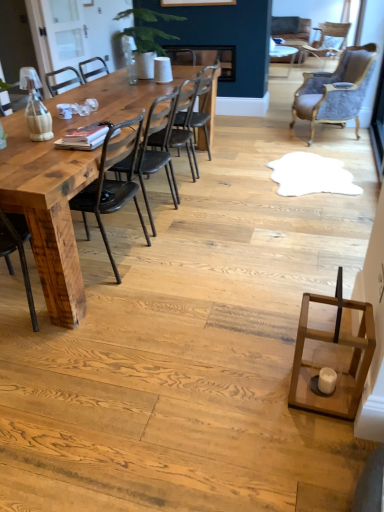
Question: Is the surface of black leather chair at center, arranged as the 3th chair when ordered from the bottom, in direct contact with velvet grey armchair at upper right, acting as the 4th chair starting from the bottom?

Choices:
 (A) yes
 (B) no

Answer: (B)

Question: From a real-world perspective, is black leather chair at center, the third chair when ordered from top to bottom, positioned under velvet grey armchair at upper right, placed as the 2th chair when sorted from back to front, based on gravity?

Choices:
 (A) no
 (B) yes

Answer: (B)

Question: Is black leather chair at center, which is the third chair in right-to-left order, shorter than velvet grey armchair at upper right, placed as the 2th chair when sorted from right to left?

Choices:
 (A) no
 (B) yes

Answer: (B)

Question: Is black leather chair at center, the third chair in the left-to-right sequence, closer to the viewer compared to velvet grey armchair at upper right, placed as the 2th chair when sorted from right to left?

Choices:
 (A) yes
 (B) no

Answer: (A)

Question: Is black leather chair at center, which is the third chair in right-to-left order, facing away from velvet grey armchair at upper right, acting as the 4th chair starting from the bottom?

Choices:
 (A) yes
 (B) no

Answer: (B)

Question: Considering the relative positions of natural wood table at left and velvet grey armchair at upper right, placed as the 2th chair when sorted from right to left, in the image provided, is natural wood table at left to the left or to the right of velvet grey armchair at upper right, placed as the 2th chair when sorted from right to left,?

Choices:
 (A) left
 (B) right

Answer: (A)

Question: From a real-world perspective, is natural wood table at left physically located above or below velvet grey armchair at upper right, the 4th chair from the left?

Choices:
 (A) above
 (B) below

Answer: (B)

Question: Is natural wood table at left situated inside velvet grey armchair at upper right, the second chair when ordered from top to bottom, or outside?

Choices:
 (A) inside
 (B) outside

Answer: (B)

Question: Relative to velvet grey armchair at upper right, arranged as the fourth chair when viewed from the front, is natural wood table at left in front or behind?

Choices:
 (A) behind
 (B) front

Answer: (B)

Question: Considering the positions of black leather chair at center, the third chair in the left-to-right sequence, and rustic wood chair at left, which ranks as the fifth chair in right-to-left order, in the image, is black leather chair at center, the third chair in the left-to-right sequence, wider or thinner than rustic wood chair at left, which ranks as the fifth chair in right-to-left order,?

Choices:
 (A) wide
 (B) thin

Answer: (B)

Question: Considering their positions, is black leather chair at center, placed as the third chair when sorted from back to front, located in front of or behind rustic wood chair at left, acting as the 1th chair starting from the bottom?

Choices:
 (A) behind
 (B) front

Answer: (A)

Question: Considering the relative positions of black leather chair at center, the third chair in the left-to-right sequence, and rustic wood chair at left, placed as the first chair when sorted from left to right, in the image provided, is black leather chair at center, the third chair in the left-to-right sequence, to the left or to the right of rustic wood chair at left, placed as the first chair when sorted from left to right,?

Choices:
 (A) right
 (B) left

Answer: (A)

Question: From the image's perspective, is black leather chair at center, which appears as the 3th chair when viewed from the front, above or below rustic wood chair at left, acting as the 1th chair starting from the bottom?

Choices:
 (A) below
 (B) above

Answer: (B)

Question: Would you say rustic wood chair at left, acting as the 1th chair starting from the bottom, is to the left or to the right of black leather chair at center, the third chair in the left-to-right sequence, in the picture?

Choices:
 (A) left
 (B) right

Answer: (A)

Question: Considering the positions of rustic wood chair at left, arranged as the fifth chair when viewed from the top, and black leather chair at center, which appears as the 3th chair when viewed from the front, in the image, is rustic wood chair at left, arranged as the fifth chair when viewed from the top, taller or shorter than black leather chair at center, which appears as the 3th chair when viewed from the front,?

Choices:
 (A) short
 (B) tall

Answer: (B)